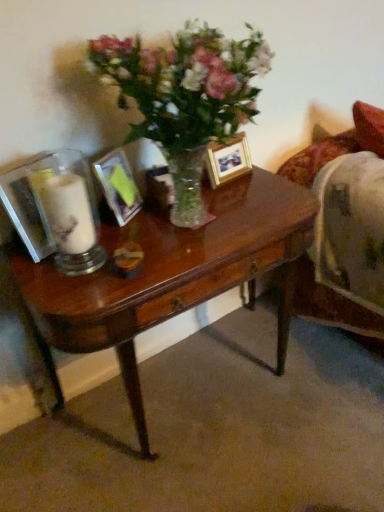
Identify the location of vacant area that is situated to the right of white matte candle at left. (126, 232).